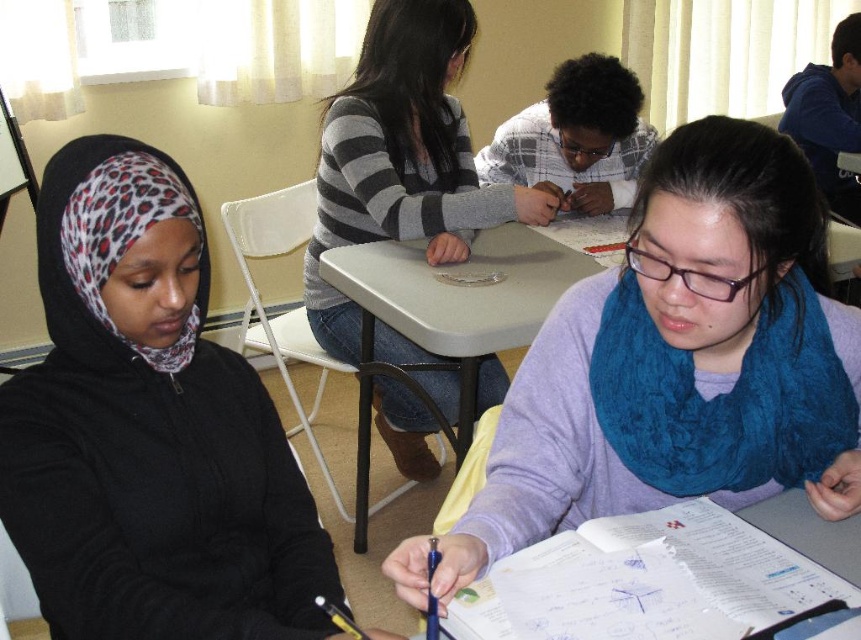
Identify the location of purple soft scarf at center. (651, 333).

Is purple soft scarf at center closer to the viewer compared to plaid fabric shirt at center?

That is True.

Is point (680, 259) positioned before point (561, 170)?

Yes, point (680, 259) is in front of point (561, 170).

The image size is (861, 640). I want to click on purple soft scarf at center, so click(x=651, y=333).

Does purple soft scarf at center have a greater width compared to striped sweater at center?

Incorrect, purple soft scarf at center's width does not surpass striped sweater at center's.

Is purple soft scarf at center positioned before striped sweater at center?

Yes.

You are a GUI agent. You are given a task and a screenshot of the screen. Output one action in this format:
    pyautogui.click(x=<x>, y=<y>)
    Task: Click on the purple soft scarf at center
    The width and height of the screenshot is (861, 640).
    Given the screenshot: What is the action you would take?
    (x=651, y=333)

Where is `purple soft scarf at center`? The height and width of the screenshot is (640, 861). purple soft scarf at center is located at coordinates [x=651, y=333].

Who is shorter, leopard print hijab at left or purple soft scarf at center?

With less height is purple soft scarf at center.

Is point (201, 301) positioned after point (729, 392)?

No, it is not.

Where is `leopard print hijab at left`? This screenshot has width=861, height=640. leopard print hijab at left is located at coordinates (149, 435).